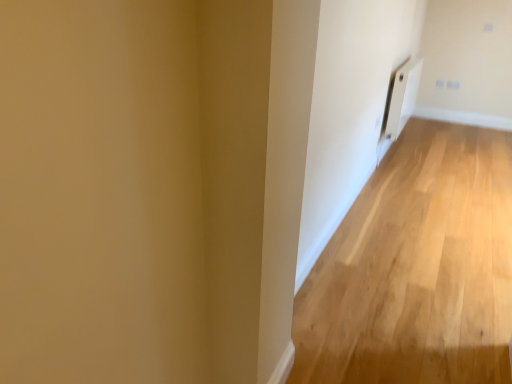
Image resolution: width=512 pixels, height=384 pixels. What are the coordinates of `blank space above light wood floor at right (from a real-world perspective)` in the screenshot? It's located at (431, 200).